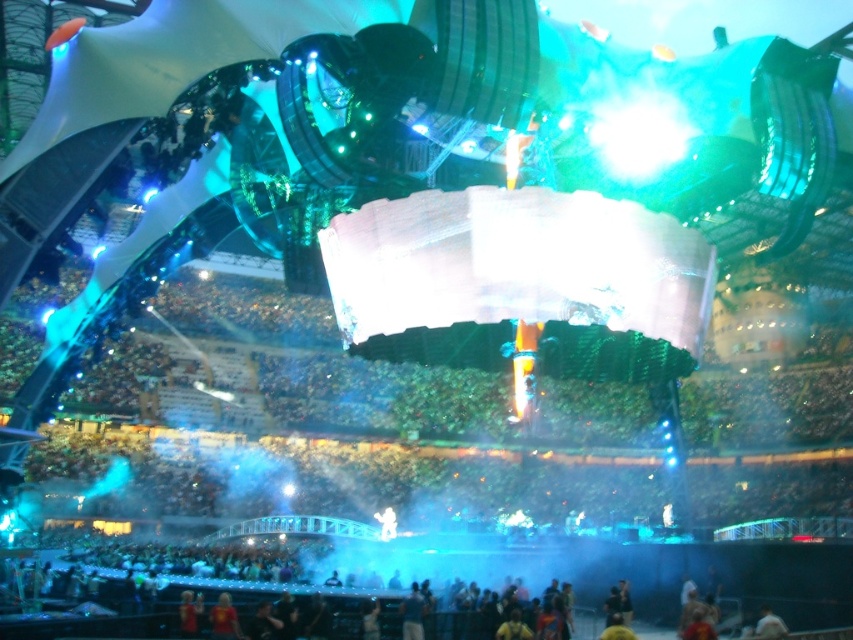
Can you confirm if red shirt at lower center is taller than white matte shirt at center?

Incorrect, red shirt at lower center's height is not larger of white matte shirt at center's.

Consider the image. Between red shirt at lower center and white matte shirt at center, which one is positioned lower?

white matte shirt at center

Measure the distance between red shirt at lower center and camera.

red shirt at lower center is 227.78 feet from camera.

Locate an element on the screen. The height and width of the screenshot is (640, 853). red shirt at lower center is located at coordinates (224, 620).

Does white matte shirt at center have a greater height compared to yellow fabric person at lower center?

No, white matte shirt at center is not taller than yellow fabric person at lower center.

Does point (759, 616) come farther from viewer compared to point (611, 634)?

Yes, it is.

This screenshot has width=853, height=640. Identify the location of white matte shirt at center. (769, 625).

Is red shirt at lower center bigger than yellow fabric person at lower center?

No.

Between red shirt at lower center and yellow fabric person at lower center, which one appears on the right side from the viewer's perspective?

yellow fabric person at lower center is more to the right.

Measure the distance between point (225,611) and camera.

The distance of point (225,611) from camera is 72.35 meters.

The height and width of the screenshot is (640, 853). Identify the location of red shirt at lower center. (224, 620).